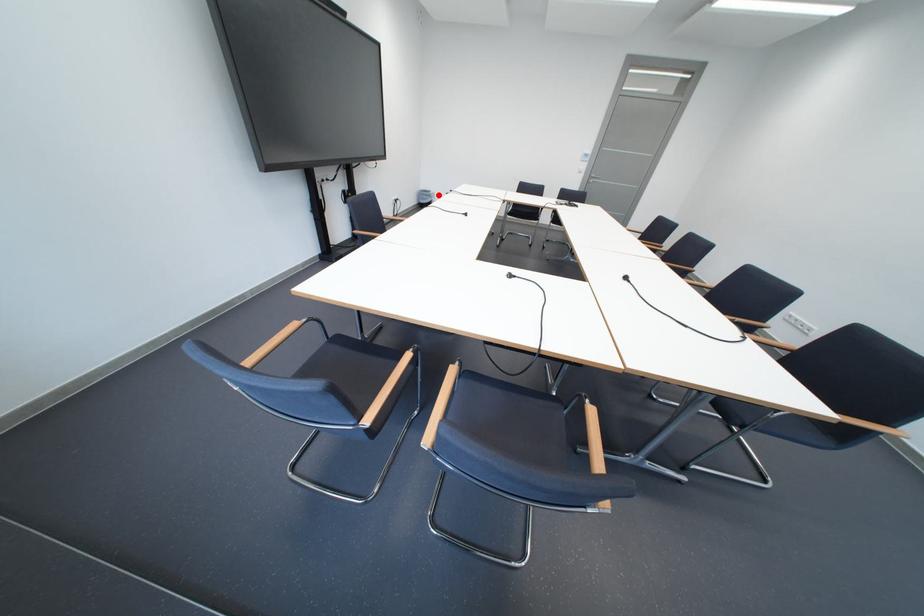
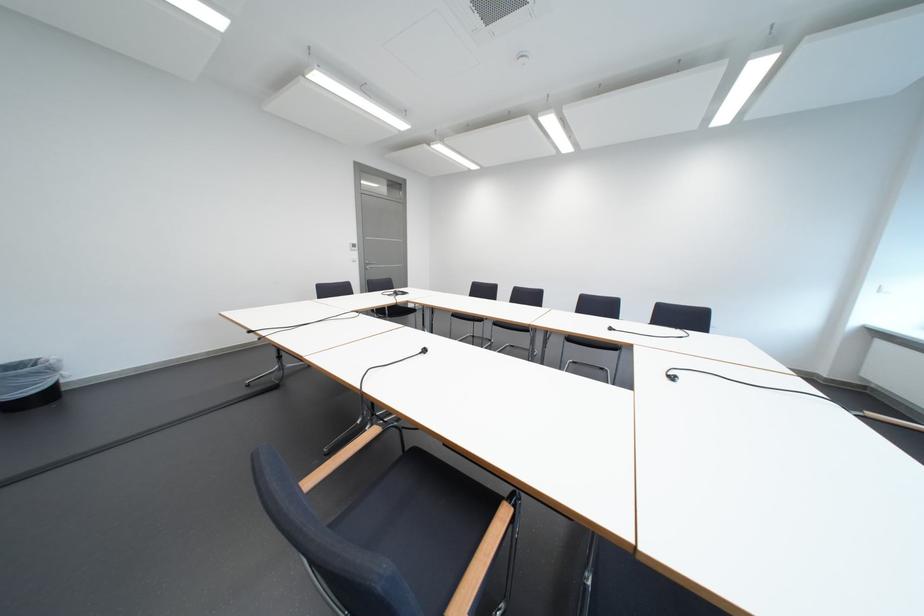
Question: A red point is marked in image1. In image2, is the corresponding 3D point closer to the camera or farther? Reply with the corresponding letter.

Choices:
 (A) The corresponding 3D point is closer.
 (B) The corresponding 3D point is farther.

Answer: (B)